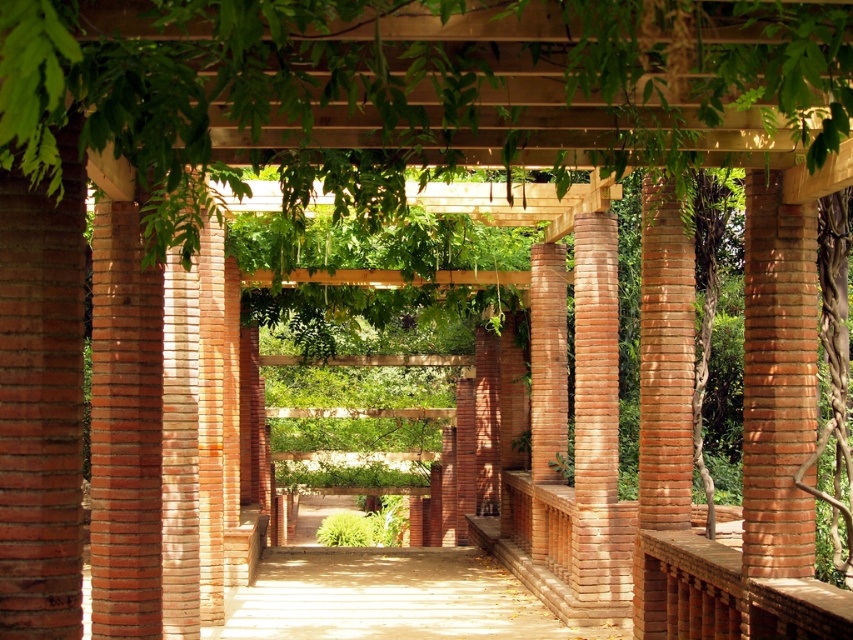
You are a landscape architect designing a pathway between the sandy brown brick column at left and the red brick column at right. The pathway needs to be 4 meters wide to accommodate a garden cart. Can the existing space between the columns support this pathway?

The sandy brown brick column at left and the red brick column at right are 3.94 meters apart from each other. Since the required pathway width is 4 meters, the existing space is slightly narrower, so the garden cart may not fit comfortably. Consider adjusting the column positions or reducing the pathway width.

You are walking through the garden passageway and want to take a photo of both the sandy brown brick column at left and the red brick column at right. Which column should you stand closer to in order to include both in your camera frame?

You should stand closer to the sandy brown brick column at left because it is nearer to you than the red brick column at right, allowing both columns to be captured in the frame.

You are walking through a garden passageway and see the sandy brown brick column at left and the red brick column at right. Which column is located to the left of the other?

The sandy brown brick column at left is positioned on the left side of the red brick column at right, so it is located to the left of the red brick column at right.